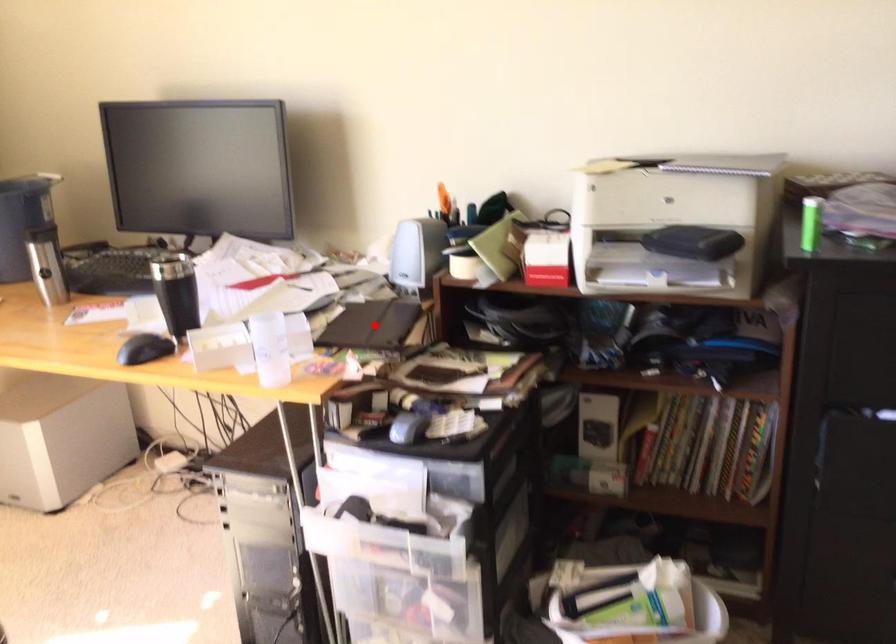
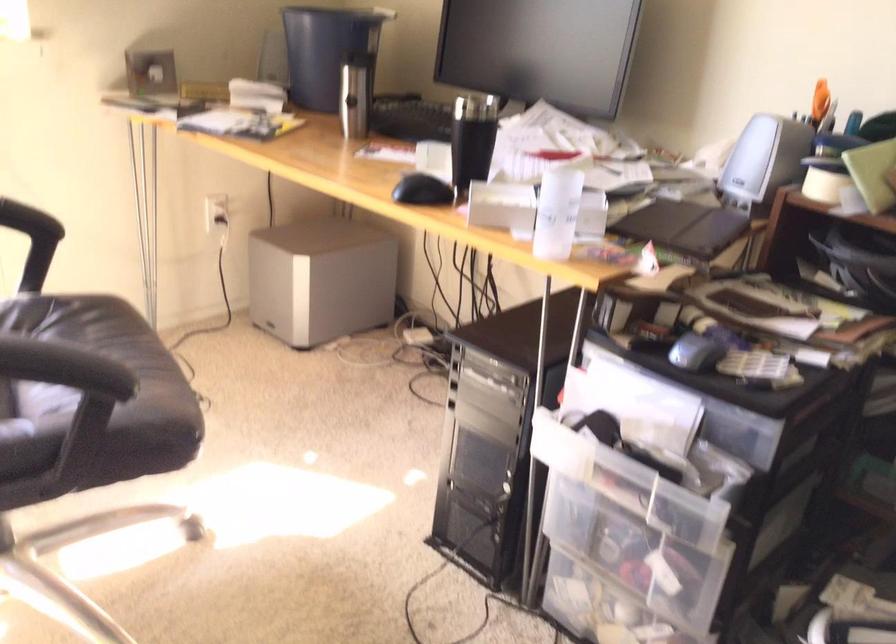
Where in the second image is the point corresponding to the highlighted location from the first image?

(684, 227)